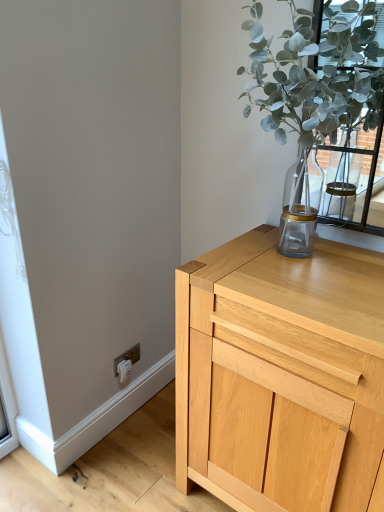
Where is `vacant space underneath green leafy plant at upper right (from a real-world perspective)`? This screenshot has height=512, width=384. vacant space underneath green leafy plant at upper right (from a real-world perspective) is located at coordinates (291, 258).